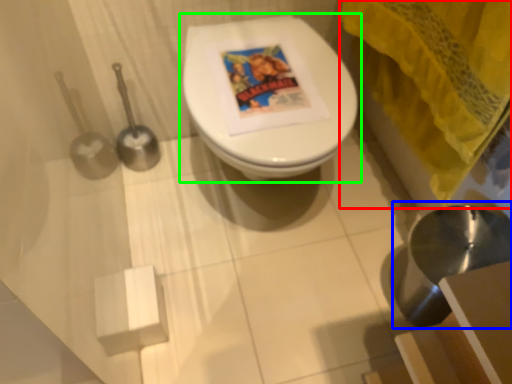
Question: Estimate the real-world distances between objects in this image. Which object is farther from curtain (highlighted by a red box), sink (highlighted by a blue box) or toilet (highlighted by a green box)?

Choices:
 (A) sink
 (B) toilet

Answer: (A)